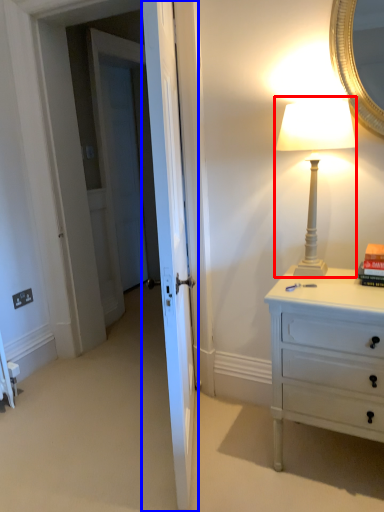
Question: Among these objects, which one is nearest to the camera, bedside lamp (highlighted by a red box) or door (highlighted by a blue box)?

Choices:
 (A) bedside lamp
 (B) door

Answer: (B)